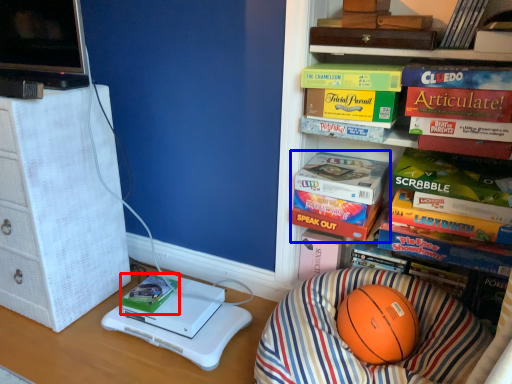
Question: Which object appears farthest to the camera in this image, book (highlighted by a red box) or book (highlighted by a blue box)?

Choices:
 (A) book
 (B) book

Answer: (A)